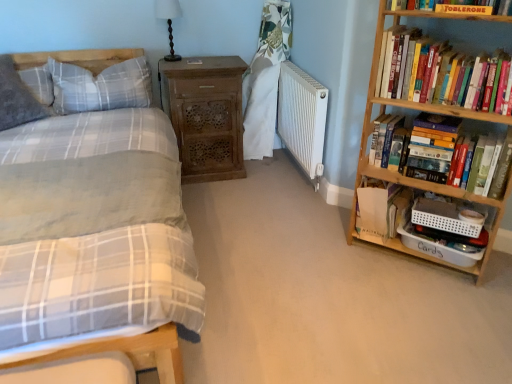
At what (x,y) coordinates should I click in order to perform the action: click on empty space that is in between wooden carved nightstand at left and wooden bookshelf at right. Please return your answer as a coordinate pair (x, y). This screenshot has width=512, height=384. Looking at the image, I should click on (272, 202).